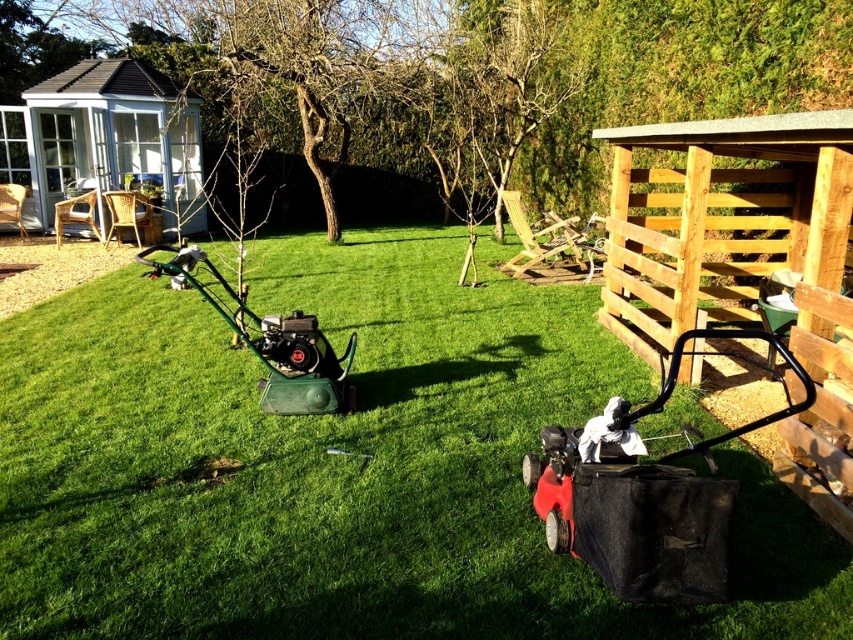
Question: Can you confirm if green grass at center is wider than white wooden hut at upper left?

Choices:
 (A) yes
 (B) no

Answer: (B)

Question: Is green grass at center to the right of white wooden hut at upper left from the viewer's perspective?

Choices:
 (A) no
 (B) yes

Answer: (B)

Question: Which point appears closest to the camera in this image?

Choices:
 (A) (405, 241)
 (B) (47, 204)

Answer: (B)

Question: Which of the following is the closest to the observer?

Choices:
 (A) green grass at center
 (B) white wooden hut at upper left

Answer: (A)

Question: Is green grass at center to the left of white wooden hut at upper left from the viewer's perspective?

Choices:
 (A) yes
 (B) no

Answer: (B)